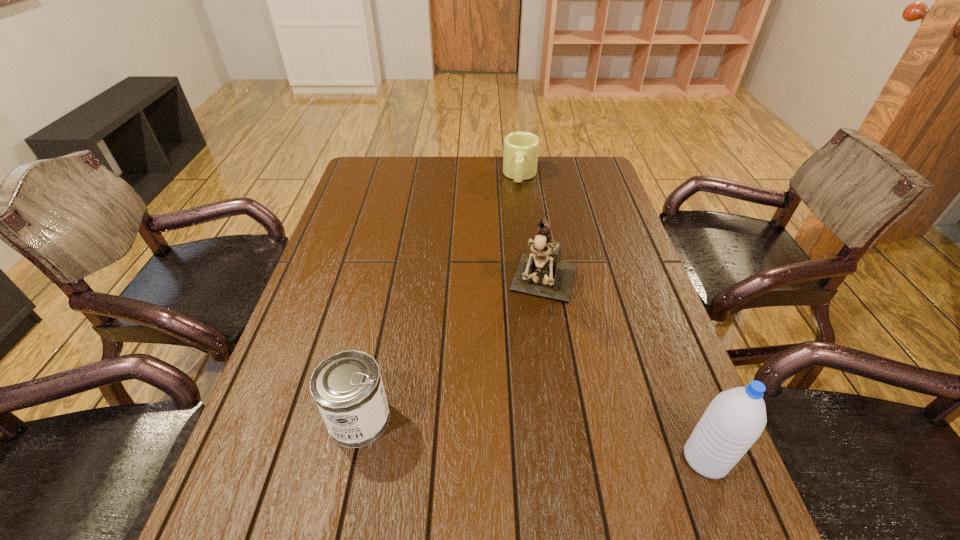
I want to click on vacant area that satisfies the following two spatial constraints: 1. on the front side of the tallest object; 2. on the right side of the third shortest object, so click(x=572, y=458).

Locate an element on the screen. The height and width of the screenshot is (540, 960). free spot that satisfies the following two spatial constraints: 1. on the front side of the farthest object; 2. on the right side of the figurine is located at coordinates (535, 287).

You are a GUI agent. You are given a task and a screenshot of the screen. Output one action in this format:
    pyautogui.click(x=<x>, y=<y>)
    Task: Click on the vacant area in the image that satisfies the following two spatial constraints: 1. on the front side of the third nearest object; 2. on the left side of the mug
    The image size is (960, 540).
    Given the screenshot: What is the action you would take?
    click(535, 287)